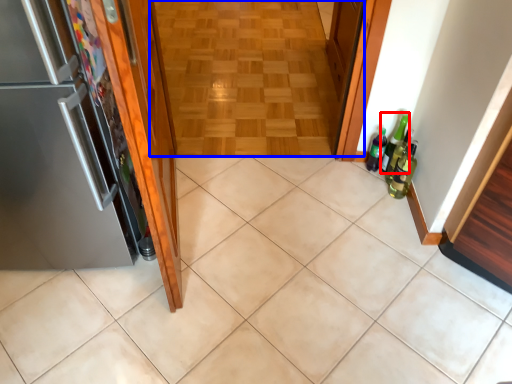
Question: Which of the following is the farthest to the observer, beer bottle (highlighted by a red box) or corridor (highlighted by a blue box)?

Choices:
 (A) beer bottle
 (B) corridor

Answer: (B)